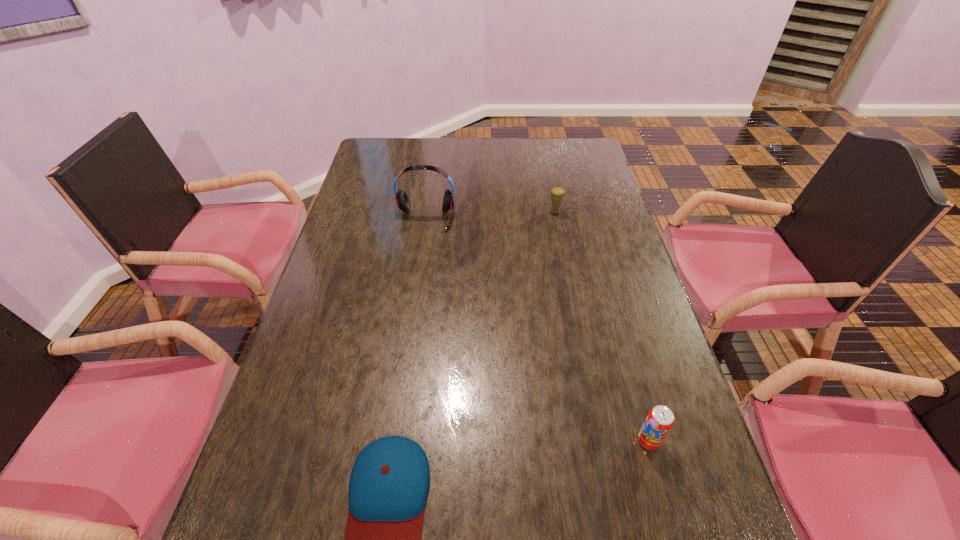
Where is `vacant space at the left edge of the desktop`? The width and height of the screenshot is (960, 540). vacant space at the left edge of the desktop is located at coordinates (349, 370).

Where is `vacant space at the right edge of the desktop`? This screenshot has height=540, width=960. vacant space at the right edge of the desktop is located at coordinates (673, 485).

Identify the location of free space between the second shortest object and the second object from right to left. (602, 326).

At what (x,y) coordinates should I click in order to perform the action: click on free space between the straw for drinking and the headset. Please return your answer as a coordinate pair (x, y). The width and height of the screenshot is (960, 540). Looking at the image, I should click on (491, 215).

Locate an element on the screen. This screenshot has width=960, height=540. free space between the tallest object and the third object from left to right is located at coordinates (491, 215).

Identify the location of free space between the headset and the second tallest object. (491, 215).

Locate an element on the screen. Image resolution: width=960 pixels, height=540 pixels. vacant space that is in between the rightmost object and the headset is located at coordinates (537, 330).

Where is `free point between the soda can and the second object from right to left`? The width and height of the screenshot is (960, 540). free point between the soda can and the second object from right to left is located at coordinates (602, 326).

Choose which object is the second nearest neighbor to the straw for drinking. Please provide its 2D coordinates. Your answer should be formatted as a tuple, i.e. [(x, y)], where the tuple contains the x and y coordinates of a point satisfying the conditions above.

[(660, 419)]

At what (x,y) coordinates should I click in order to perform the action: click on object that is the nearest to the tallest object. Please return your answer as a coordinate pair (x, y). Looking at the image, I should click on [x=557, y=193].